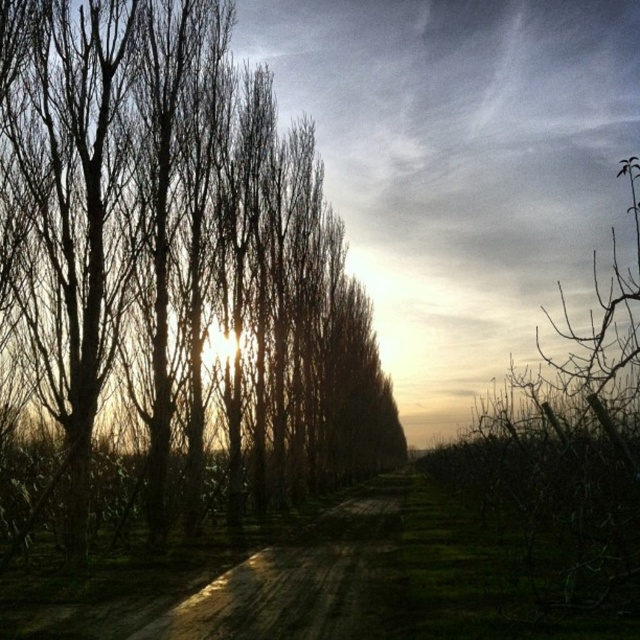
Question: Can you confirm if bare branches at center is positioned to the left of dull brown dirt track at center?

Choices:
 (A) yes
 (B) no

Answer: (B)

Question: From the image, what is the correct spatial relationship of bare branches at center in relation to dull brown dirt track at center?

Choices:
 (A) below
 (B) above

Answer: (B)

Question: Can you confirm if bare branches at center is positioned below dull brown dirt track at center?

Choices:
 (A) yes
 (B) no

Answer: (B)

Question: Among these points, which one is farthest from the camera?

Choices:
 (A) (376, 371)
 (B) (257, 580)

Answer: (A)

Question: Which point appears closest to the camera in this image?

Choices:
 (A) (202, 611)
 (B) (168, 458)

Answer: (A)